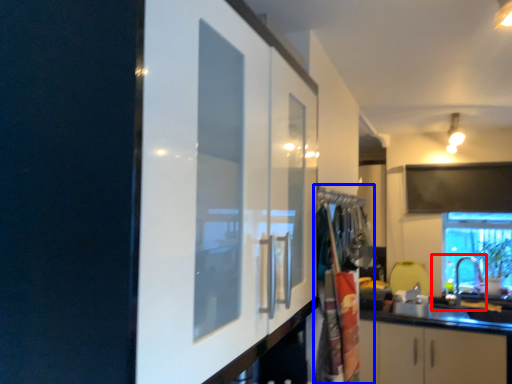
Question: Which point is closer to the camera, sink (highlighted by a red box) or laundry (highlighted by a blue box)?

Choices:
 (A) sink
 (B) laundry

Answer: (B)